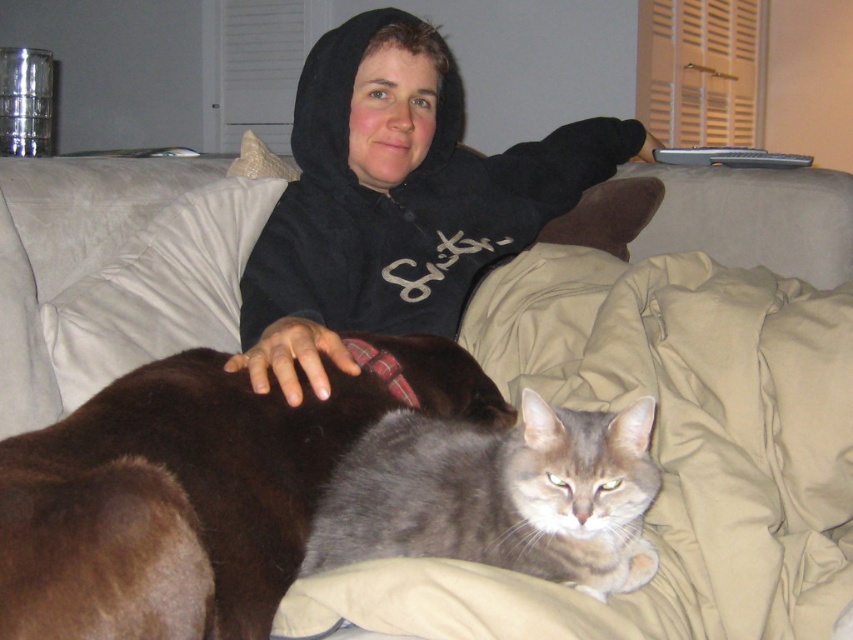
Question: Estimate the real-world distances between objects in this image. Which object is closer to the brown fur cat at center?

Choices:
 (A) black hoodie at upper center
 (B) gray fur cat at center

Answer: (B)

Question: Does gray fur cat at center have a greater width compared to matte gray pillow at upper right?

Choices:
 (A) yes
 (B) no

Answer: (A)

Question: Which object is the farthest from the black hoodie at upper center?

Choices:
 (A) gray fur cat at center
 (B) matte gray pillow at upper right
 (C) brown fur cat at center

Answer: (A)

Question: Among these objects, which one is farthest from the camera?

Choices:
 (A) matte gray pillow at upper right
 (B) gray fur cat at center
 (C) brown fur cat at center

Answer: (A)

Question: Is brown fur cat at center behind gray fur cat at center?

Choices:
 (A) no
 (B) yes

Answer: (A)

Question: Can you confirm if brown fur cat at center is bigger than gray fur cat at center?

Choices:
 (A) no
 (B) yes

Answer: (B)